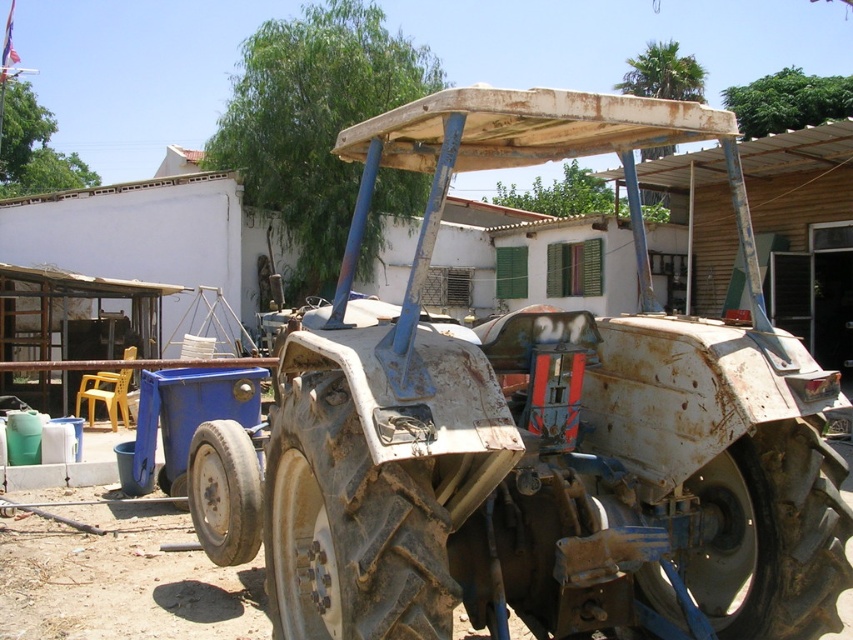
You are a farmer inspecting your property. You see the rusty metal tractor at center and the rusty metal tire at lower center. Which object is larger in size?

The rusty metal tractor at center is bigger than the rusty metal tire at lower center.

You are standing at the origin point of the coordinate system in this image. You see a point marked at coordinate (546, 428). What object is located at that point?

The point at coordinate (546, 428) marks the rusty metal tractor at center.

Consider the image. You are a mechanic inspecting the tractor. You notice two tires on the tractor. The dusty rubber tire at center and the rusty metal tire at lower center. Which tire is taller?

The dusty rubber tire at center is taller than the rusty metal tire at lower center.